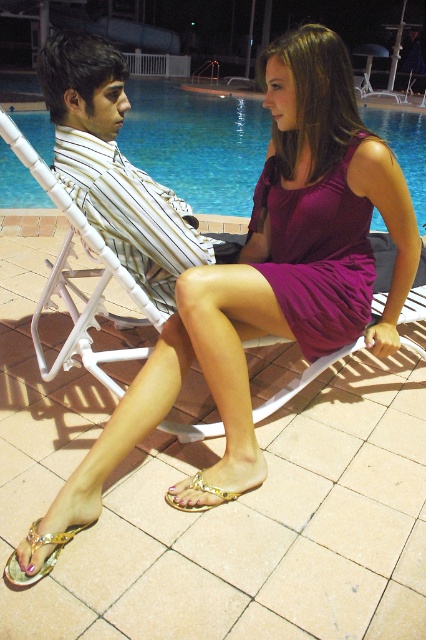
Question: Can you confirm if white striped fabric chair at center is positioned to the right of gold metallic sandal at lower left?

Choices:
 (A) no
 (B) yes

Answer: (B)

Question: Does purple satin dress at center have a greater width compared to gold metallic sandal at lower left?

Choices:
 (A) yes
 (B) no

Answer: (A)

Question: Does striped cotton shirt at center appear over purple satin dress at center?

Choices:
 (A) no
 (B) yes

Answer: (B)

Question: Among these objects, which one is nearest to the camera?

Choices:
 (A) striped cotton shirt at center
 (B) gold metallic sandal at lower left
 (C) gold metallic sandal at lower center

Answer: (B)

Question: Which object appears closest to the camera in this image?

Choices:
 (A) striped cotton shirt at center
 (B) purple satin dress at center
 (C) white striped fabric chair at center
 (D) blue glass swimming pool at center

Answer: (C)

Question: Estimate the real-world distances between objects in this image. Which object is farther from the gold metallic sandal at lower center?

Choices:
 (A) gold metallic sandal at lower left
 (B) purple satin dress at center
 (C) blue glass swimming pool at center
 (D) striped cotton shirt at center

Answer: (C)